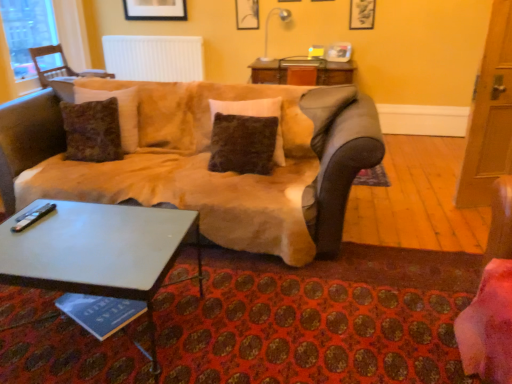
What is the approximate height of white ribbed radiator at upper center?

52.80 centimeters.

What do you see at coordinates (154, 58) in the screenshot?
I see `white ribbed radiator at upper center` at bounding box center [154, 58].

This screenshot has height=384, width=512. What do you see at coordinates (362, 14) in the screenshot?
I see `matte black picture frame at upper right, marked as the 2th picture frame in a back-to-front arrangement` at bounding box center [362, 14].

What do you see at coordinates (60, 66) in the screenshot?
I see `wooden chair at left` at bounding box center [60, 66].

The height and width of the screenshot is (384, 512). What are the coordinates of `wooden chair at left` in the screenshot? It's located at (60, 66).

What do you see at coordinates (27, 32) in the screenshot? This screenshot has width=512, height=384. I see `transparent glass window at upper left` at bounding box center [27, 32].

Looking at this image, in order to face fuzzy brown pillow at center, should I rotate leftwards or rightwards?

You should look left and rotate roughly 1.995 degrees.

Locate an element on the screen. This screenshot has height=384, width=512. suede-like beige couch at center is located at coordinates (204, 161).

From a real-world perspective, which is physically above, matte black picture frame at upper right, the second picture frame when ordered from left to right, or matte black picture frame at upper center, the 1th picture frame when ordered from back to front?

In real-world perspective, matte black picture frame at upper center, the 1th picture frame when ordered from back to front, is above.

Can you confirm if matte black picture frame at upper right, marked as the 1th picture frame in a right-to-left arrangement, is shorter than matte black picture frame at upper center, which ranks as the 2th picture frame in front-to-back order?

Indeed, matte black picture frame at upper right, marked as the 1th picture frame in a right-to-left arrangement, has a lesser height compared to matte black picture frame at upper center, which ranks as the 2th picture frame in front-to-back order.

Is matte black picture frame at upper right, marked as the 2th picture frame in a back-to-front arrangement, positioned far away from matte black picture frame at upper center, the 1th picture frame when ordered from back to front?

Absolutely, matte black picture frame at upper right, marked as the 2th picture frame in a back-to-front arrangement, is distant from matte black picture frame at upper center, the 1th picture frame when ordered from back to front.

Which is more to the left, wooden chair at left or white ribbed radiator at upper center?

wooden chair at left is more to the left.

From a real-world perspective, is wooden chair at left under white ribbed radiator at upper center?

Yes, from a real-world perspective, wooden chair at left is beneath white ribbed radiator at upper center.

Is wooden chair at left surrounding white ribbed radiator at upper center?

No, white ribbed radiator at upper center is not a part of wooden chair at left.

Is transparent glass window at upper left bigger than wooden chair at left?

No, transparent glass window at upper left is not bigger than wooden chair at left.

Considering the points (56, 44) and (53, 45), which point is in front, point (56, 44) or point (53, 45)?

The point (53, 45) is more forward.

From the image's perspective, is transparent glass window at upper left under wooden chair at left?

Actually, transparent glass window at upper left appears above wooden chair at left in the image.

Is transparent glass window at upper left positioned before wooden chair at left?

Yes, transparent glass window at upper left is closer to the viewer.

Is white glossy lamp at upper center completely or partially outside of transparent glass window at upper left?

white glossy lamp at upper center is positioned outside transparent glass window at upper left.

Does white glossy lamp at upper center have a smaller size compared to transparent glass window at upper left?

Yes.

Would you consider white glossy lamp at upper center to be distant from transparent glass window at upper left?

That's right, there is a large distance between white glossy lamp at upper center and transparent glass window at upper left.

Is transparent glass window at upper left at the back of white glossy lamp at upper center?

white glossy lamp at upper center does not have its back to transparent glass window at upper left.

From their relative heights in the image, would you say matte black picture frame at upper center, the 1th picture frame when ordered from back to front, is taller or shorter than white ribbed radiator at upper center?

Considering their sizes, matte black picture frame at upper center, the 1th picture frame when ordered from back to front, has less height than white ribbed radiator at upper center.

Is matte black picture frame at upper center, the 1th picture frame when ordered from back to front, oriented towards white ribbed radiator at upper center?

No.

From a real-world perspective, between matte black picture frame at upper center, which is the second picture frame from right to left, and white ribbed radiator at upper center, who is vertically lower?

white ribbed radiator at upper center, from a real-world perspective.

Which object is more forward, matte black picture frame at upper center, the 1th picture frame when ordered from left to right, or white ribbed radiator at upper center?

matte black picture frame at upper center, the 1th picture frame when ordered from left to right, is closer to the camera.

Do you think white glossy coffee table at lower left is within matte black picture frame at upper right, the second picture frame when ordered from left to right, or outside of it?

white glossy coffee table at lower left is spatially situated outside matte black picture frame at upper right, the second picture frame when ordered from left to right.

From the image's perspective, which one is positioned higher, white glossy coffee table at lower left or matte black picture frame at upper right, marked as the 2th picture frame in a back-to-front arrangement?

matte black picture frame at upper right, marked as the 2th picture frame in a back-to-front arrangement, appears higher in the image.

Is white glossy coffee table at lower left touching matte black picture frame at upper right, marked as the 1th picture frame in a right-to-left arrangement?

white glossy coffee table at lower left and matte black picture frame at upper right, marked as the 1th picture frame in a right-to-left arrangement, are clearly separated.

In terms of width, does wooden chair at left look wider or thinner when compared to fuzzy brown pillow at center?

Clearly, wooden chair at left has more width compared to fuzzy brown pillow at center.

This screenshot has height=384, width=512. What are the coordinates of `pillow in front of the wooden chair at left` in the screenshot? It's located at (247, 107).

From the picture: Which object is positioned more to the right, wooden chair at left or fuzzy brown pillow at center?

Positioned to the right is fuzzy brown pillow at center.

Does wooden chair at left have a greater height compared to fuzzy brown pillow at center?

No, wooden chair at left is not taller than fuzzy brown pillow at center.

This screenshot has height=384, width=512. Identify the location of picture frame that appears below the matte black picture frame at upper center, the 1th picture frame when ordered from back to front (from the image's perspective). (362, 14).

Locate an element on the screen. This screenshot has width=512, height=384. radiator above the wooden chair at left (from the image's perspective) is located at coordinates (154, 58).

Based on their spatial positions, is wooden chair at left or transparent glass window at upper left further from suede-like beige couch at center?

Among the two, wooden chair at left is located further to suede-like beige couch at center.

Estimate the real-world distances between objects in this image. Which object is closer to white glossy lamp at upper center, wooden chair at left or matte black picture frame at upper right, marked as the 2th picture frame in a back-to-front arrangement?

matte black picture frame at upper right, marked as the 2th picture frame in a back-to-front arrangement.

Based on the photo, from the image, which object appears to be farther from transparent glass window at upper left, fuzzy brown pillow at center or wooden chair at left?

Based on the image, fuzzy brown pillow at center appears to be further to transparent glass window at upper left.

From the image, which object appears to be nearer to suede-like beige couch at center, wooden chair at left or matte black picture frame at upper center, which is the second picture frame from right to left?

wooden chair at left.

When comparing their distances from white ribbed radiator at upper center, does suede-like beige couch at center or white glossy lamp at upper center seem closer?

white glossy lamp at upper center.

Which object lies nearer to the anchor point matte black picture frame at upper center, the 1th picture frame when ordered from left to right, fuzzy brown pillow at center or suede-like beige couch at center?

fuzzy brown pillow at center.

Estimate the real-world distances between objects in this image. Which object is further from wooden chair at left, white ribbed radiator at upper center or white glossy lamp at upper center?

Among the two, white glossy lamp at upper center is located further to wooden chair at left.

From the image, which object appears to be nearer to wooden chair at left, matte black picture frame at upper center, the 1th picture frame when ordered from left to right, or suede-like beige couch at center?

matte black picture frame at upper center, the 1th picture frame when ordered from left to right, is closer to wooden chair at left.

The image size is (512, 384). Identify the location of pillow located between white glossy coffee table at lower left and white glossy lamp at upper center in the depth direction. (247, 107).

What are the coordinates of `chair positioned between suede-like beige couch at center and matte black picture frame at upper center, the 1th picture frame when ordered from left to right, from near to far` in the screenshot? It's located at (60, 66).

Find the location of a particular element. Image resolution: width=512 pixels, height=384 pixels. picture frame situated between transparent glass window at upper left and matte black picture frame at upper right, marked as the 1th picture frame in a right-to-left arrangement, from left to right is located at coordinates (247, 14).

Find the location of a particular element. chair between white glossy coffee table at lower left and white glossy lamp at upper center along the z-axis is located at coordinates (60, 66).